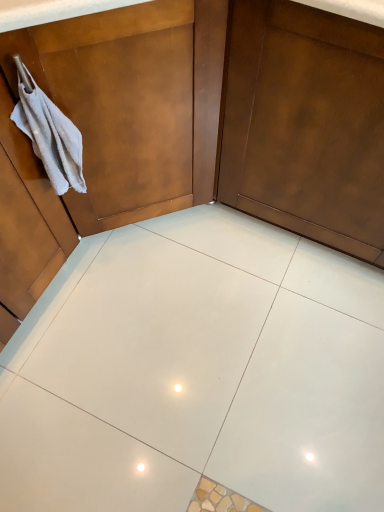
Question: From a real-world perspective, is white glossy tile at center located beneath matte brown door at center?

Choices:
 (A) yes
 (B) no

Answer: (A)

Question: Is white glossy tile at center turned away from matte brown door at center?

Choices:
 (A) no
 (B) yes

Answer: (A)

Question: Can you confirm if white glossy tile at center is shorter than matte brown door at center?

Choices:
 (A) no
 (B) yes

Answer: (B)

Question: Considering the relative positions of white glossy tile at center and matte brown door at center in the image provided, is white glossy tile at center in front of matte brown door at center?

Choices:
 (A) no
 (B) yes

Answer: (A)

Question: Does white glossy tile at center have a greater height compared to matte brown door at center?

Choices:
 (A) no
 (B) yes

Answer: (A)

Question: From the image's perspective, is matte brown door at center located above or below white glossy tile at center?

Choices:
 (A) above
 (B) below

Answer: (A)

Question: Is matte brown door at center spatially inside white glossy tile at center, or outside of it?

Choices:
 (A) inside
 (B) outside

Answer: (B)

Question: Looking at their shapes, would you say matte brown door at center is wider or thinner than white glossy tile at center?

Choices:
 (A) thin
 (B) wide

Answer: (A)

Question: From a real-world perspective, is matte brown door at center above or below white glossy tile at center?

Choices:
 (A) above
 (B) below

Answer: (A)

Question: From their relative heights in the image, would you say matte brown dresser at upper left is taller or shorter than white glossy tile at center?

Choices:
 (A) short
 (B) tall

Answer: (B)

Question: From the image's perspective, is matte brown dresser at upper left above or below white glossy tile at center?

Choices:
 (A) above
 (B) below

Answer: (A)

Question: Is point coord(59,86) positioned closer to the camera than point coord(105,374)?

Choices:
 (A) closer
 (B) farther

Answer: (A)

Question: In the image, is matte brown dresser at upper left on the left side or the right side of white glossy tile at center?

Choices:
 (A) left
 (B) right

Answer: (A)

Question: In terms of size, does white cotton hand towel at left appear bigger or smaller than matte brown dresser at upper left?

Choices:
 (A) small
 (B) big

Answer: (A)

Question: From the image's perspective, relative to matte brown dresser at upper left, is white cotton hand towel at left above or below?

Choices:
 (A) above
 (B) below

Answer: (B)